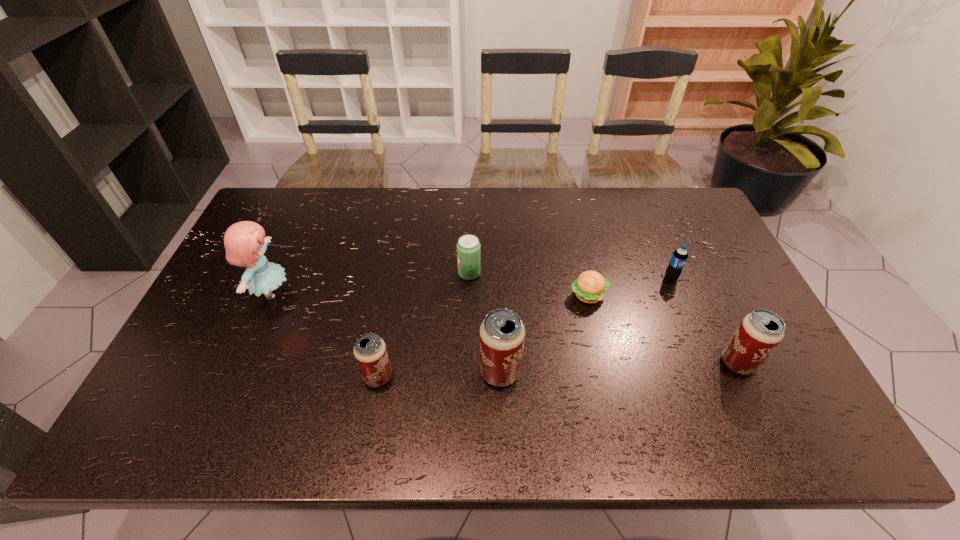
At what (x,y) coordinates should I click in order to perform the action: click on the closest beer can to the second beer can from right to left. Please return your answer as a coordinate pair (x, y). Looking at the image, I should click on (370, 351).

Identify the location of beer can that is the second closest to the left soda. (370, 351).

Where is `free space in the image that satisfies the following two spatial constraints: 1. on the back side of the second beer can from left to right; 2. on the right side of the second object from right to left`? Image resolution: width=960 pixels, height=540 pixels. free space in the image that satisfies the following two spatial constraints: 1. on the back side of the second beer can from left to right; 2. on the right side of the second object from right to left is located at coordinates (496, 278).

Where is `vacant space that satisfies the following two spatial constraints: 1. on the front side of the left soda; 2. on the left side of the rightmost beer can`? This screenshot has height=540, width=960. vacant space that satisfies the following two spatial constraints: 1. on the front side of the left soda; 2. on the left side of the rightmost beer can is located at coordinates (468, 363).

Where is `free space that satisfies the following two spatial constraints: 1. on the front side of the left soda; 2. on the right side of the hamburger`? This screenshot has height=540, width=960. free space that satisfies the following two spatial constraints: 1. on the front side of the left soda; 2. on the right side of the hamburger is located at coordinates (468, 295).

Locate an element on the screen. vacant area that satisfies the following two spatial constraints: 1. on the front-facing side of the third tallest object; 2. on the right side of the leftmost object is located at coordinates (240, 363).

This screenshot has width=960, height=540. Identify the location of free space in the image that satisfies the following two spatial constraints: 1. on the back side of the second beer can from left to right; 2. on the front-facing side of the leftmost object. (497, 293).

Where is `free space that satisfies the following two spatial constraints: 1. on the back side of the left soda; 2. on the left side of the second object from left to right`? free space that satisfies the following two spatial constraints: 1. on the back side of the left soda; 2. on the left side of the second object from left to right is located at coordinates (397, 273).